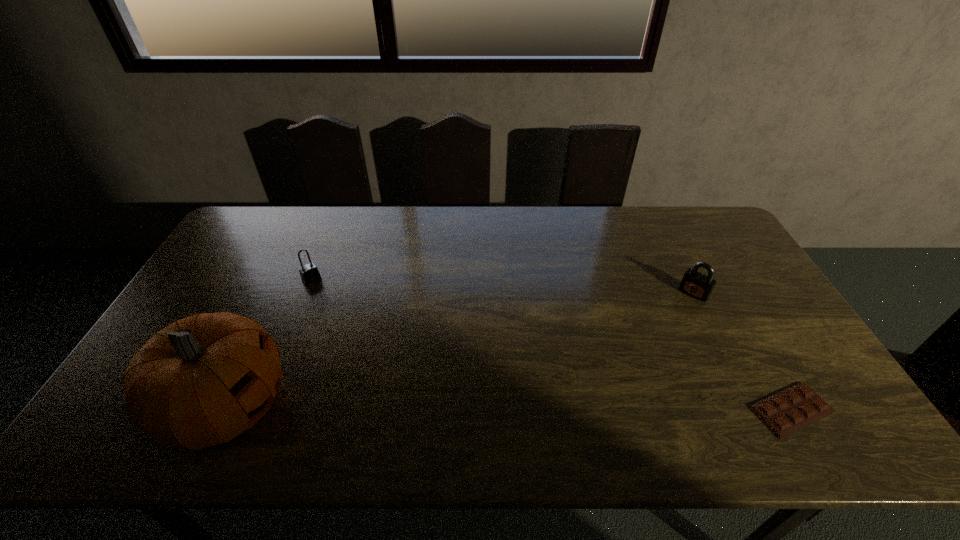
This screenshot has height=540, width=960. I want to click on vacant space located on the shackle of the left padlock, so click(333, 302).

You are a GUI agent. You are given a task and a screenshot of the screen. Output one action in this format:
    pyautogui.click(x=<x>, y=<y>)
    Task: Click on the free spot located 0.280m on the shackle of the left padlock
    The width and height of the screenshot is (960, 540).
    Given the screenshot: What is the action you would take?
    pyautogui.click(x=364, y=335)

I want to click on pumpkin that is at the near edge, so click(x=203, y=380).

Identify the location of chocolate bar that is at the near edge. The width and height of the screenshot is (960, 540). (786, 412).

I want to click on object at the left edge, so click(203, 380).

Where is `object that is at the right edge`? The width and height of the screenshot is (960, 540). object that is at the right edge is located at coordinates (786, 412).

In order to click on object that is positioned at the near left corner in this screenshot , I will do `click(203, 380)`.

Where is `object present at the near right corner`? object present at the near right corner is located at coordinates tap(786, 412).

In the image, there is a desktop. Where is `blank space at the far edge`? The width and height of the screenshot is (960, 540). blank space at the far edge is located at coordinates (514, 235).

The image size is (960, 540). Find the location of `vacant position at the near edge of the desktop`. vacant position at the near edge of the desktop is located at coordinates [323, 402].